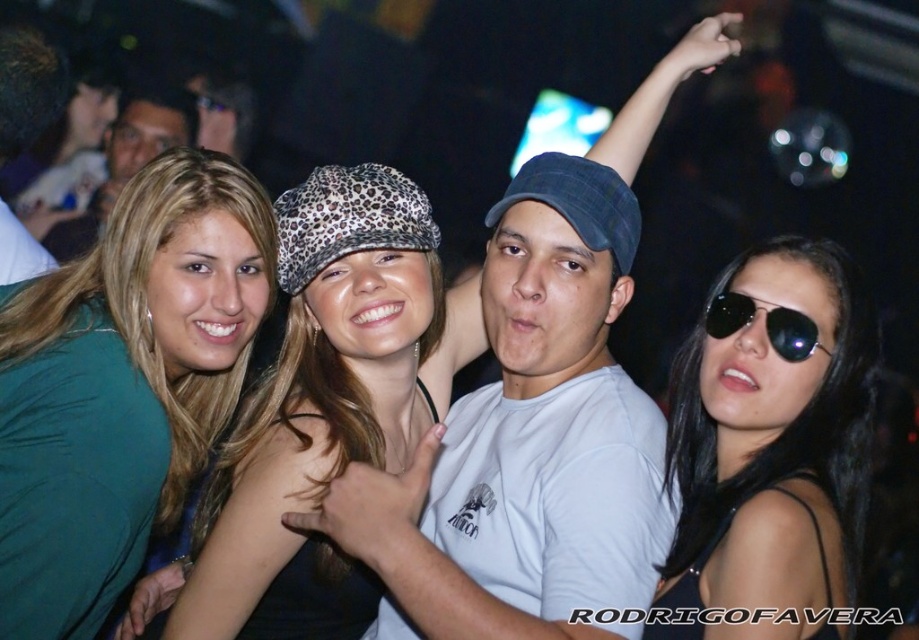
Measure the distance from leopard print hat at center to matte black tank top at center.

leopard print hat at center is 1.06 inches away from matte black tank top at center.

Is leopard print hat at center smaller than matte black tank top at center?

Yes, leopard print hat at center is smaller than matte black tank top at center.

Describe the element at coordinates (330, 380) in the screenshot. This screenshot has height=640, width=919. I see `leopard print hat at center` at that location.

You are a GUI agent. You are given a task and a screenshot of the screen. Output one action in this format:
    pyautogui.click(x=<x>, y=<y>)
    Task: Click on the leopard print hat at center
    The width and height of the screenshot is (919, 640).
    Given the screenshot: What is the action you would take?
    pyautogui.click(x=330, y=380)

Based on the photo, does matte green shirt at upper left have a smaller size compared to matte black glasses at upper left?

Actually, matte green shirt at upper left might be larger than matte black glasses at upper left.

Can you confirm if matte green shirt at upper left is shorter than matte black glasses at upper left?

In fact, matte green shirt at upper left may be taller than matte black glasses at upper left.

Describe the element at coordinates (126, 160) in the screenshot. I see `matte green shirt at upper left` at that location.

Image resolution: width=919 pixels, height=640 pixels. Find the location of `matte green shirt at upper left`. matte green shirt at upper left is located at coordinates (126, 160).

Is leopard print hat at center below black aviator sunglasses at right?

Yes.

This screenshot has height=640, width=919. In order to click on leopard print hat at center in this screenshot , I will do `click(330, 380)`.

Locate an element on the screen. The image size is (919, 640). leopard print hat at center is located at coordinates (330, 380).